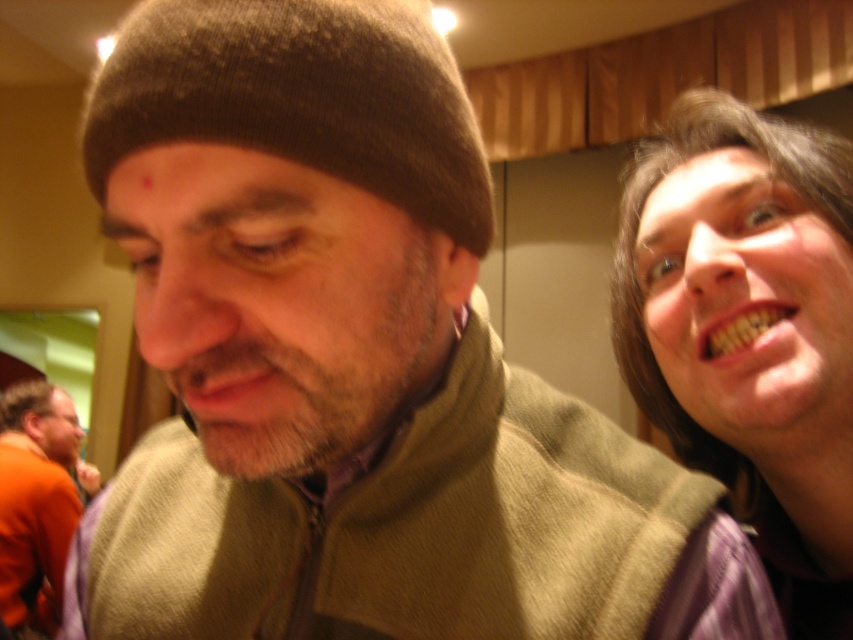
You are standing in the restaurant and want to move from the point marked by coordinates point (265, 99) to the point marked by coordinates point (7, 609). Which direction should you move?

You should move towards the lower right direction because point (265, 99) is in front of point (7, 609), indicating that the latter is located behind and to the lower right of the first point.

You are a fashion designer observing the scene. You notice the brown knit beanie at upper left and the orange matte shirt at lower left. Which clothing item is shorter in height?

The brown knit beanie at upper left is shorter than the orange matte shirt at lower left.